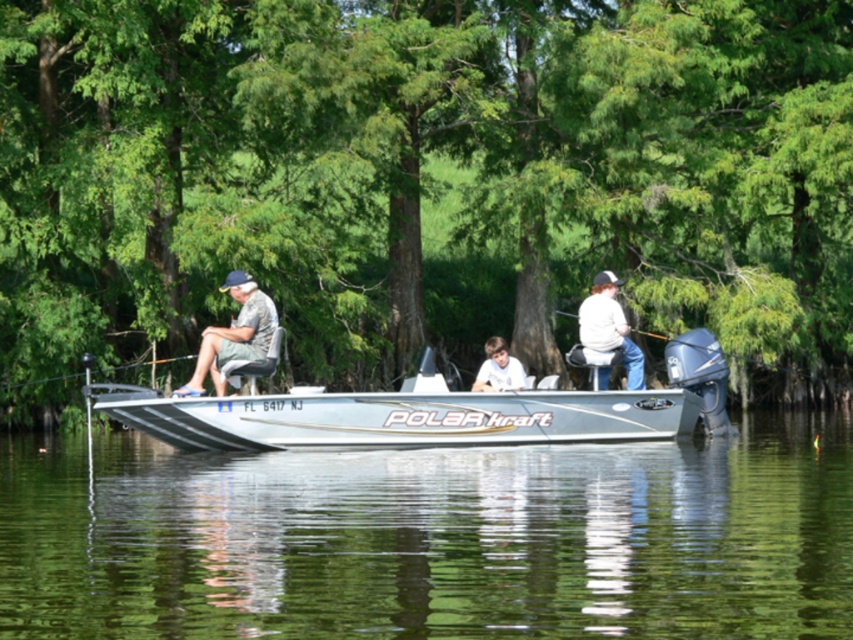
Question: Among these objects, which one is farthest from the camera?

Choices:
 (A) gray fabric shorts at left
 (B) white matte jacket at center
 (C) clear water at center

Answer: (B)

Question: Which object is farther from the camera taking this photo?

Choices:
 (A) white matte jacket at center
 (B) silver metallic boat at center

Answer: (A)

Question: Is gray fabric shorts at left above white matte shirt at center?

Choices:
 (A) yes
 (B) no

Answer: (A)

Question: Does green leafy tree at center appear on the right side of gray fabric shorts at left?

Choices:
 (A) yes
 (B) no

Answer: (A)

Question: In this image, where is green leafy tree at center located relative to white matte jacket at center?

Choices:
 (A) right
 (B) left

Answer: (B)

Question: Considering the real-world distances, which object is farthest from the white matte jacket at center?

Choices:
 (A) gray fabric shorts at left
 (B) white matte shirt at center
 (C) silver metallic boat at center
 (D) green leafy tree at center

Answer: (D)